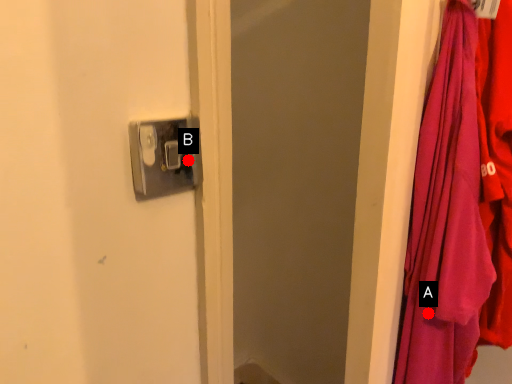
Question: Two points are circled on the image, labeled by A and B beside each circle. Which point is farther to the camera?

Choices:
 (A) A is further
 (B) B is further

Answer: (A)